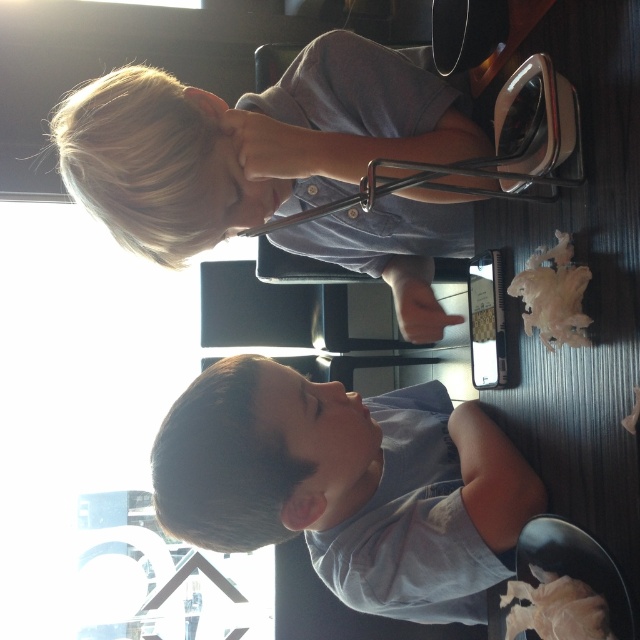
Is light brown hair at upper left wider than short dark hair at lower left?

Correct, the width of light brown hair at upper left exceeds that of short dark hair at lower left.

Which is behind, point (288, 198) or point (225, 493)?

Positioned behind is point (288, 198).

At what (x,y) coordinates should I click in order to perform the action: click on light brown hair at upper left. Please return your answer as a coordinate pair (x, y). Looking at the image, I should click on (248, 141).

Based on the photo, does light brown hair at upper left appear on the left side of gray cotton shirt at lower center?

Correct, you'll find light brown hair at upper left to the left of gray cotton shirt at lower center.

Who is shorter, light brown hair at upper left or gray cotton shirt at lower center?

gray cotton shirt at lower center is shorter.

At what (x,y) coordinates should I click in order to perform the action: click on light brown hair at upper left. Please return your answer as a coordinate pair (x, y). This screenshot has height=640, width=640. Looking at the image, I should click on (248, 141).

Can you confirm if gray cotton shirt at lower center is bigger than short dark hair at lower left?

Yes.

Does gray cotton shirt at lower center have a lesser width compared to short dark hair at lower left?

No, gray cotton shirt at lower center is not thinner than short dark hair at lower left.

Looking at this image, who is more forward, (356,556) or (252,529)?

Point (252,529) is in front.

Identify the location of gray cotton shirt at lower center. The width and height of the screenshot is (640, 640). (348, 484).